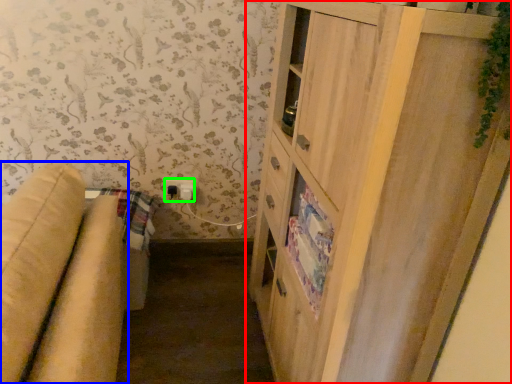
Question: Considering the real-world distances, which object is farthest from cupboard (highlighted by a red box)? studio couch (highlighted by a blue box) or electric outlet (highlighted by a green box)?

Choices:
 (A) studio couch
 (B) electric outlet

Answer: (B)